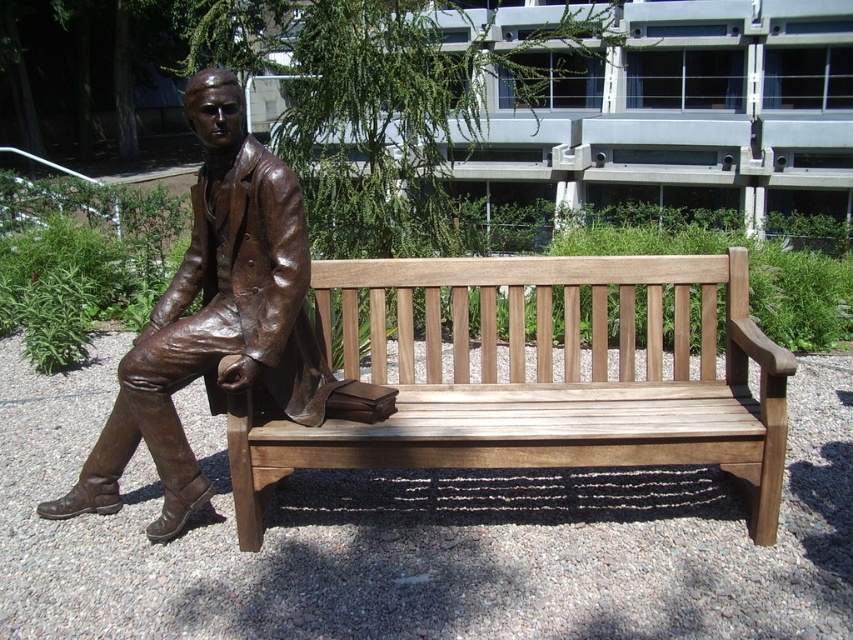
Question: Which object appears farthest from the camera in this image?

Choices:
 (A) light brown wood bench at center
 (B) bronze statue at center

Answer: (B)

Question: Is light brown wood bench at center smaller than bronze statue at center?

Choices:
 (A) no
 (B) yes

Answer: (A)

Question: Which point is closer to the camera?

Choices:
 (A) (401, 436)
 (B) (67, 497)

Answer: (A)

Question: Does light brown wood bench at center appear on the left side of bronze statue at center?

Choices:
 (A) no
 (B) yes

Answer: (A)

Question: Does light brown wood bench at center have a greater width compared to bronze statue at center?

Choices:
 (A) yes
 (B) no

Answer: (A)

Question: Which of the following is the closest to the observer?

Choices:
 (A) (280, 294)
 (B) (405, 266)

Answer: (A)